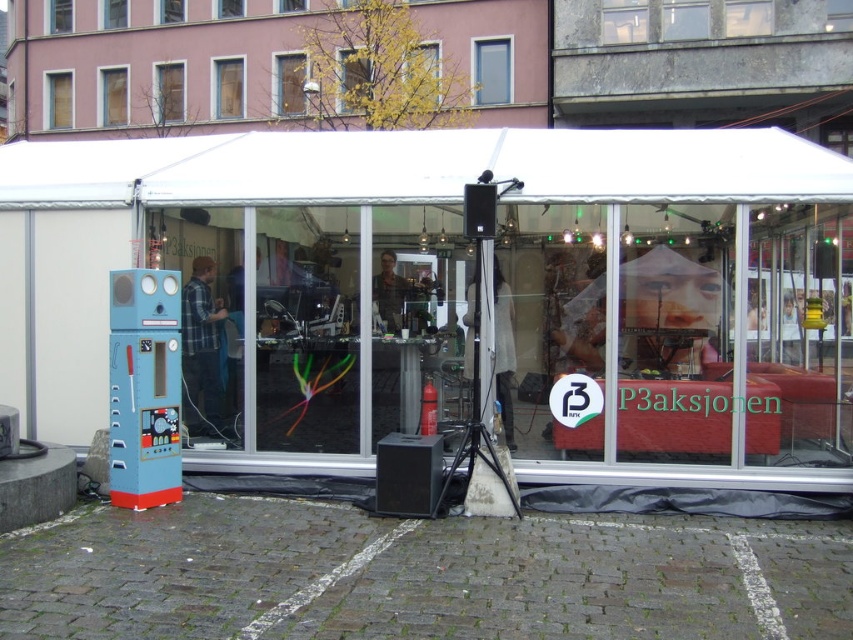
Who is positioned more to the right, white fabric canopy at upper center or blue painted metal vending machine at left?

white fabric canopy at upper center is more to the right.

Is point (430, 177) positioned in front of point (151, 426)?

No, (430, 177) is behind (151, 426).

I want to click on white fabric canopy at upper center, so click(x=425, y=168).